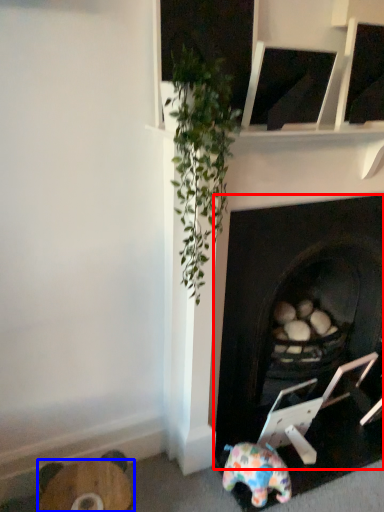
Question: Which object appears farthest to the camera in this image, fireplace (highlighted by a red box) or furniture (highlighted by a blue box)?

Choices:
 (A) fireplace
 (B) furniture

Answer: (B)